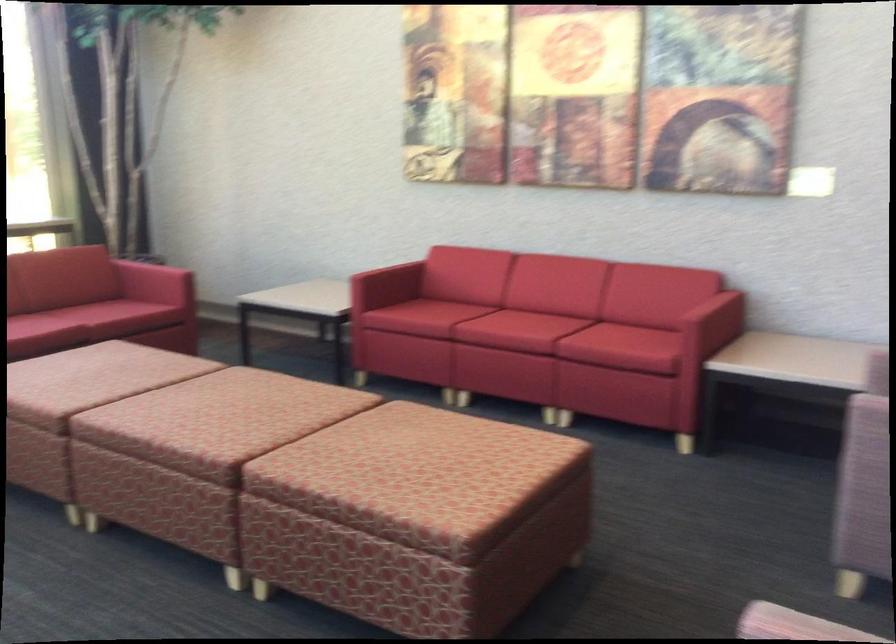
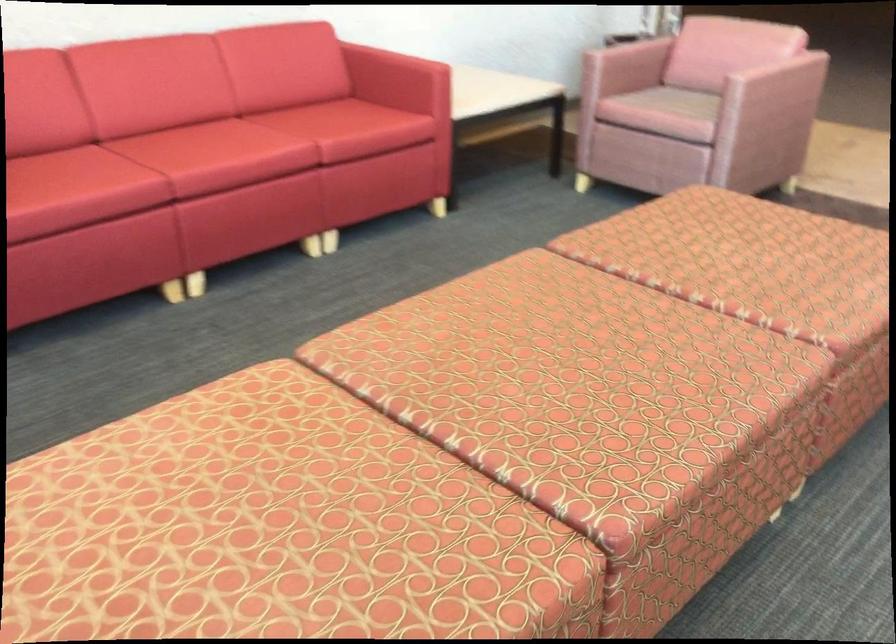
In the second image, find the point that corresponds to [512,313] in the first image.

(196, 144)